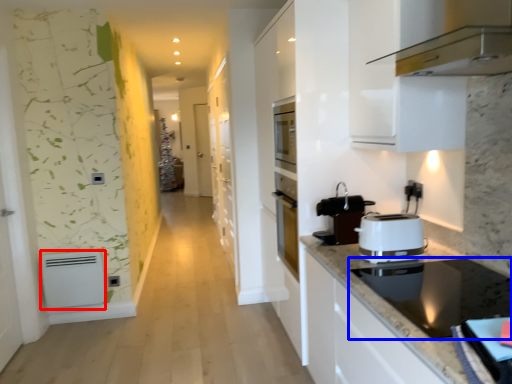
Question: Which point is closer to the camera, appliance (highlighted by a red box) or home appliance (highlighted by a blue box)?

Choices:
 (A) appliance
 (B) home appliance

Answer: (B)